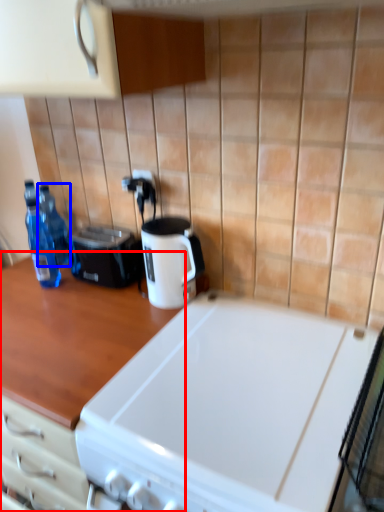
Question: Which object appears closest to the camera in this image, countertop (highlighted by a red box) or bottle (highlighted by a blue box)?

Choices:
 (A) countertop
 (B) bottle

Answer: (A)